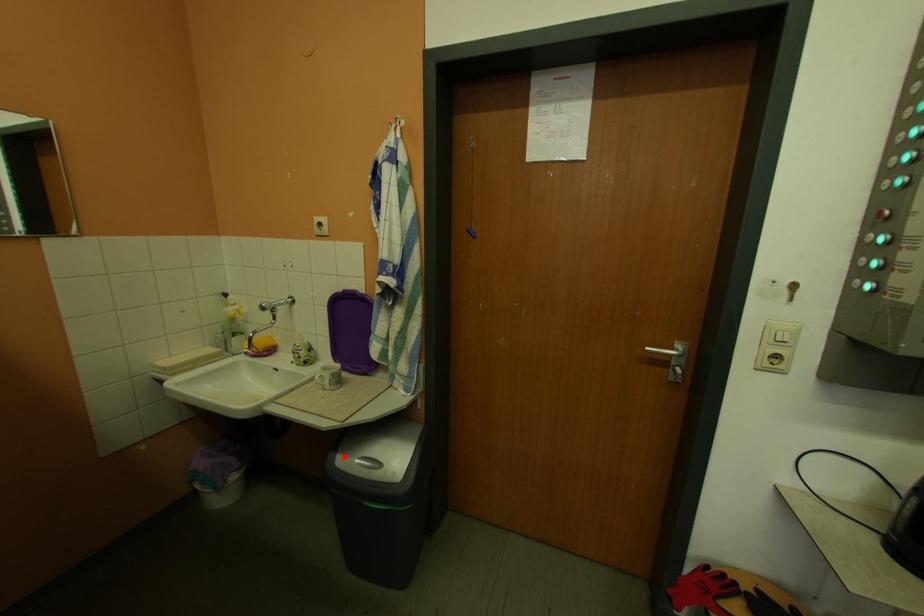
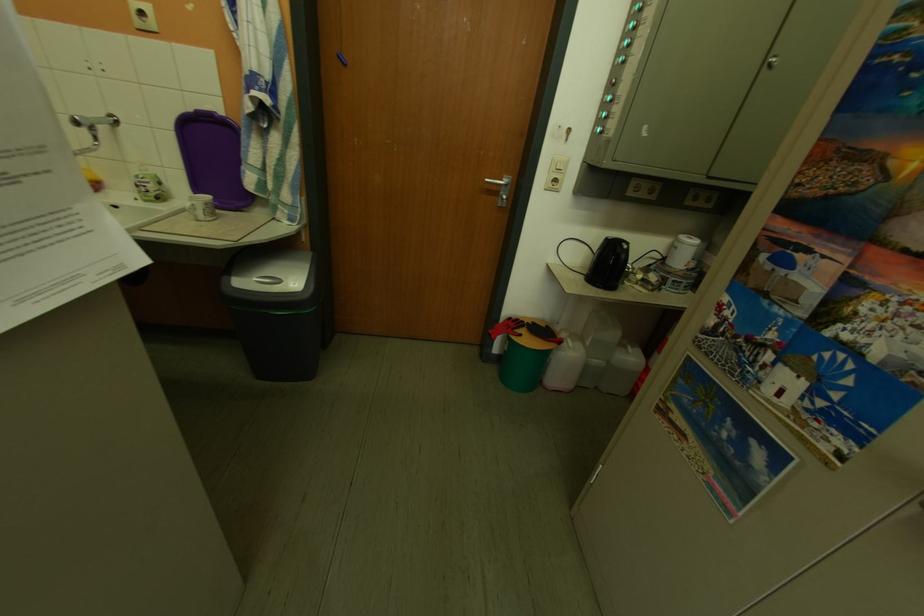
In the second image, find the point that corresponds to the highlighted location in the first image.

(237, 280)